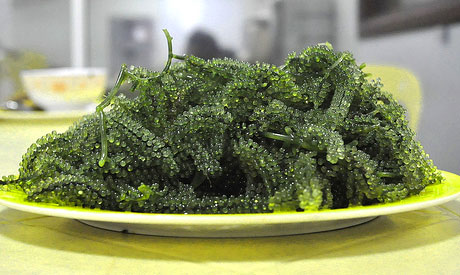
Find the location of `table on background`. table on background is located at coordinates click(18, 130).